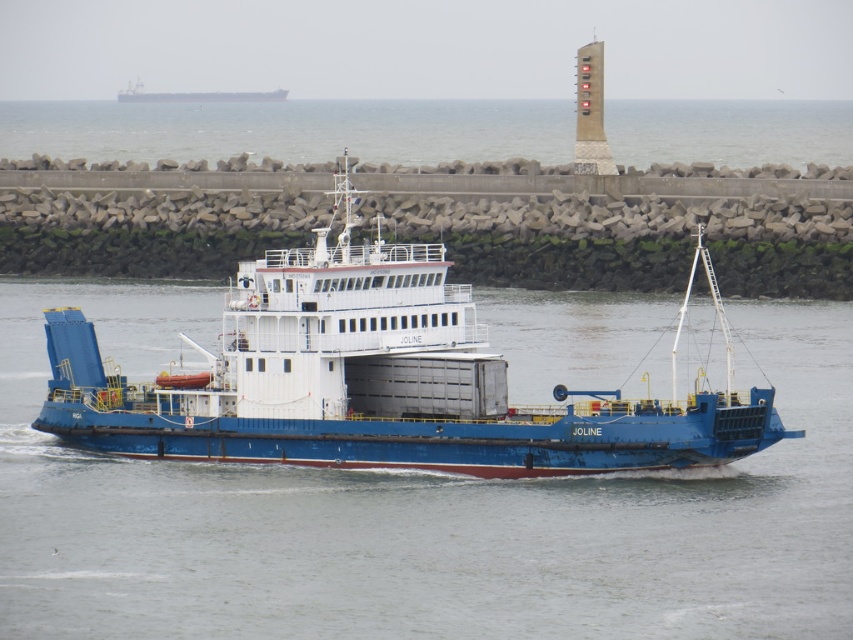
You are a marine biologist observing the ferry JOLINE from a research boat. You notice the blue matte cargo ship at center and the gray concrete water at center. Which object is nearer to your boat?

The blue matte cargo ship at center is closer to the viewer than the gray concrete water at center, so the blue matte cargo ship at center is nearer to your boat.